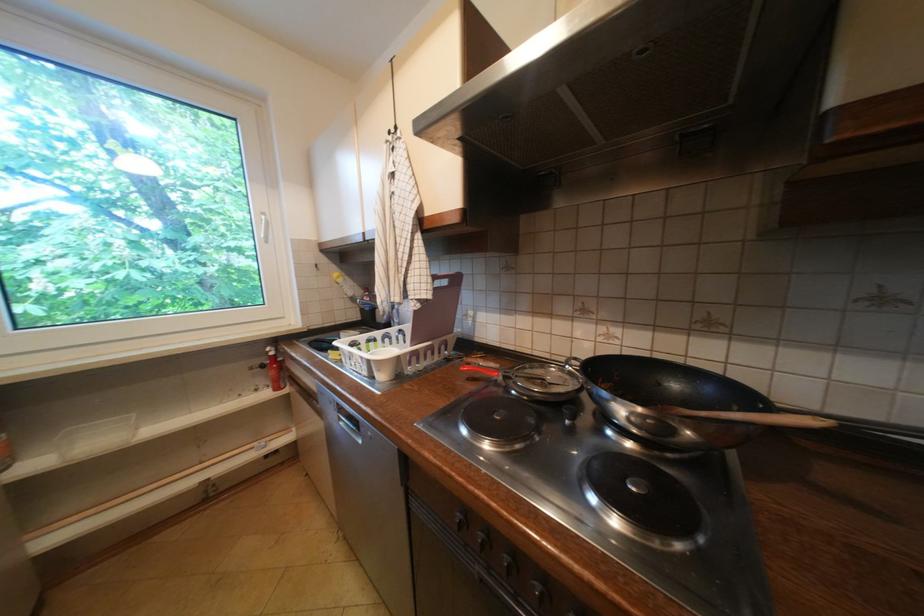
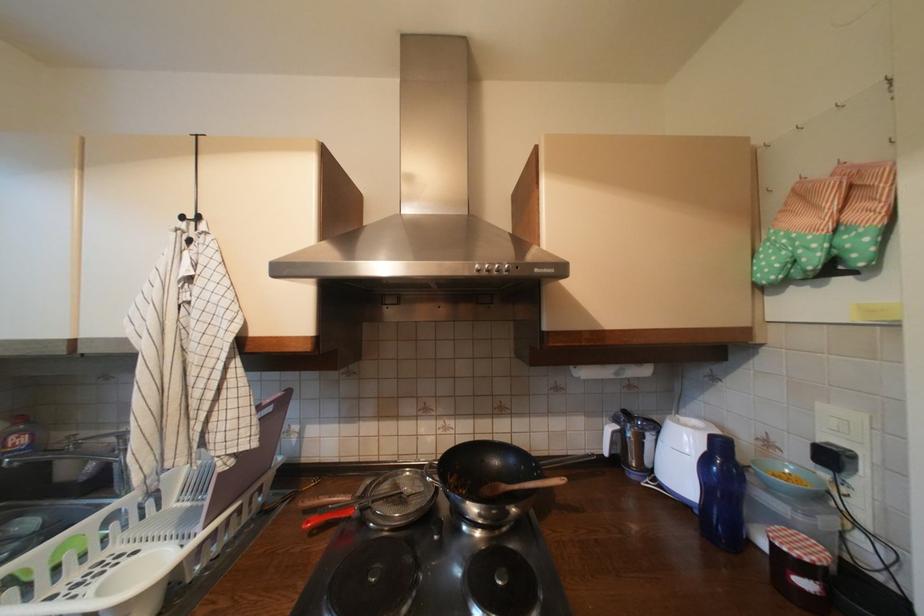
Find the pixel in the second image that matches [553,381] in the first image.

(410, 495)